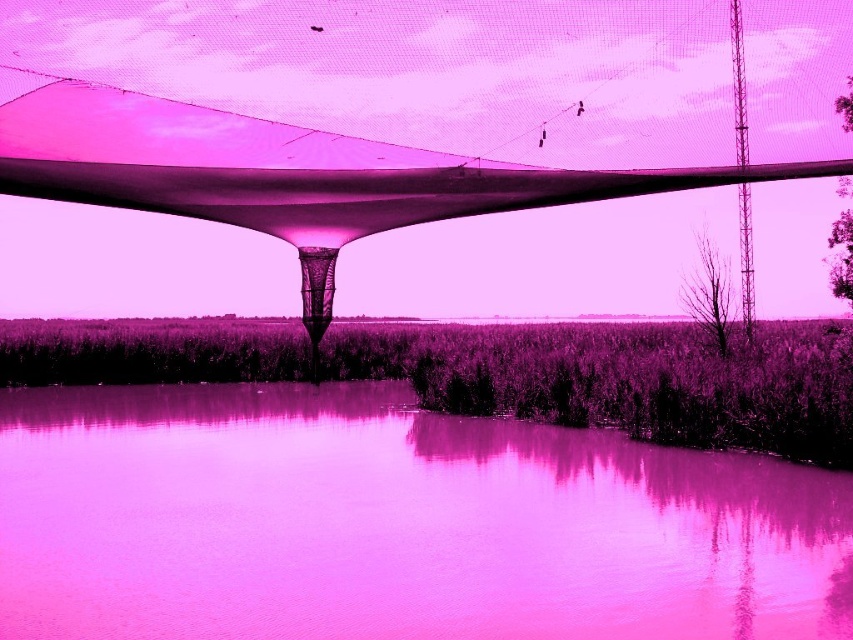
Question: Considering the relative positions of pink glossy water at lower center and transparent fabric canopy at center in the image provided, where is pink glossy water at lower center located with respect to transparent fabric canopy at center?

Choices:
 (A) below
 (B) above

Answer: (A)

Question: Is pink glossy water at lower center to the left of transparent fabric canopy at center from the viewer's perspective?

Choices:
 (A) no
 (B) yes

Answer: (B)

Question: Which of the following is the farthest from the observer?

Choices:
 (A) pink glossy water at lower center
 (B) transparent fabric canopy at center

Answer: (B)

Question: Can you confirm if pink glossy water at lower center is positioned to the left of transparent fabric canopy at center?

Choices:
 (A) yes
 (B) no

Answer: (A)

Question: Which object is closer to the camera taking this photo?

Choices:
 (A) pink glossy water at lower center
 (B) transparent fabric canopy at center

Answer: (A)